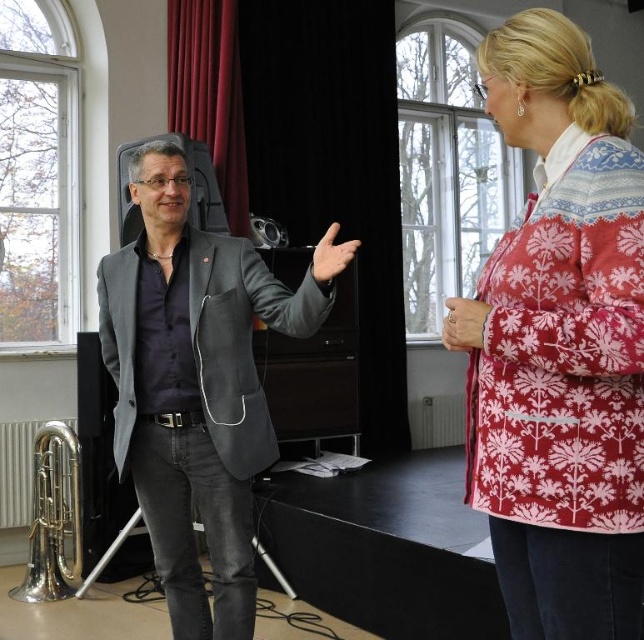
Question: Which point is closer to the camera?

Choices:
 (A) gray matte blazer at center
 (B) patterned woolen jacket at upper right

Answer: (B)

Question: Can you confirm if patterned woolen jacket at upper right is positioned to the right of gray matte blazer at center?

Choices:
 (A) no
 (B) yes

Answer: (B)

Question: Does patterned woolen jacket at upper right appear on the left side of gray matte blazer at center?

Choices:
 (A) no
 (B) yes

Answer: (A)

Question: Is the position of patterned woolen jacket at upper right less distant than that of gray matte blazer at center?

Choices:
 (A) no
 (B) yes

Answer: (B)